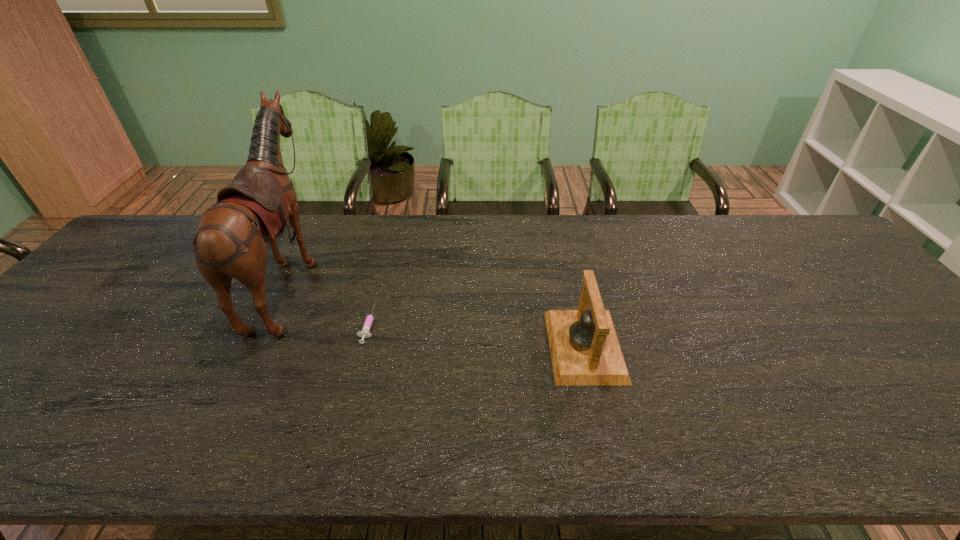
Locate an element on the screen. blank area in the image that satisfies the following two spatial constraints: 1. on the back side of the second tallest object; 2. on the back of the saddle is located at coordinates (569, 280).

The width and height of the screenshot is (960, 540). Find the location of `vacant area in the image that satisfies the following two spatial constraints: 1. on the back of the rightmost object; 2. on the right side of the tallest object`. vacant area in the image that satisfies the following two spatial constraints: 1. on the back of the rightmost object; 2. on the right side of the tallest object is located at coordinates (259, 346).

The image size is (960, 540). In order to click on free location that satisfies the following two spatial constraints: 1. on the back of the tallest object; 2. on the back side of the bell in this screenshot , I will do `click(259, 346)`.

This screenshot has width=960, height=540. Find the location of `vacant space that satisfies the following two spatial constraints: 1. on the back of the bell; 2. on the left side of the leftmost object`. vacant space that satisfies the following two spatial constraints: 1. on the back of the bell; 2. on the left side of the leftmost object is located at coordinates (259, 346).

Where is `free location that satisfies the following two spatial constraints: 1. on the back of the saddle; 2. on the right side of the second object from left to right`? Image resolution: width=960 pixels, height=540 pixels. free location that satisfies the following two spatial constraints: 1. on the back of the saddle; 2. on the right side of the second object from left to right is located at coordinates (270, 324).

The width and height of the screenshot is (960, 540). Identify the location of vacant space that satisfies the following two spatial constraints: 1. on the back of the bell; 2. on the left side of the leftmost object. (x=259, y=346).

Locate an element on the screen. vacant space that satisfies the following two spatial constraints: 1. on the front side of the syringe; 2. on the right side of the bell is located at coordinates (363, 346).

Identify the location of free location that satisfies the following two spatial constraints: 1. on the back of the rightmost object; 2. on the left side of the saddle. (259, 346).

The height and width of the screenshot is (540, 960). What are the coordinates of `vacant space that satisfies the following two spatial constraints: 1. on the back of the saddle; 2. on the back side of the bell` in the screenshot? It's located at point(259,346).

This screenshot has height=540, width=960. What are the coordinates of `vacant region that satisfies the following two spatial constraints: 1. on the back of the tallest object; 2. on the left side of the bell` in the screenshot? It's located at (259, 346).